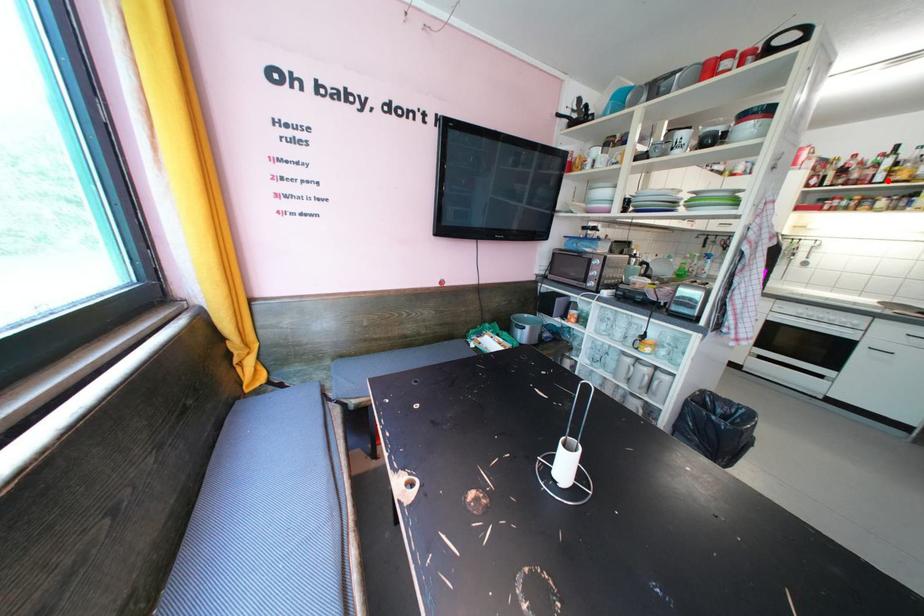
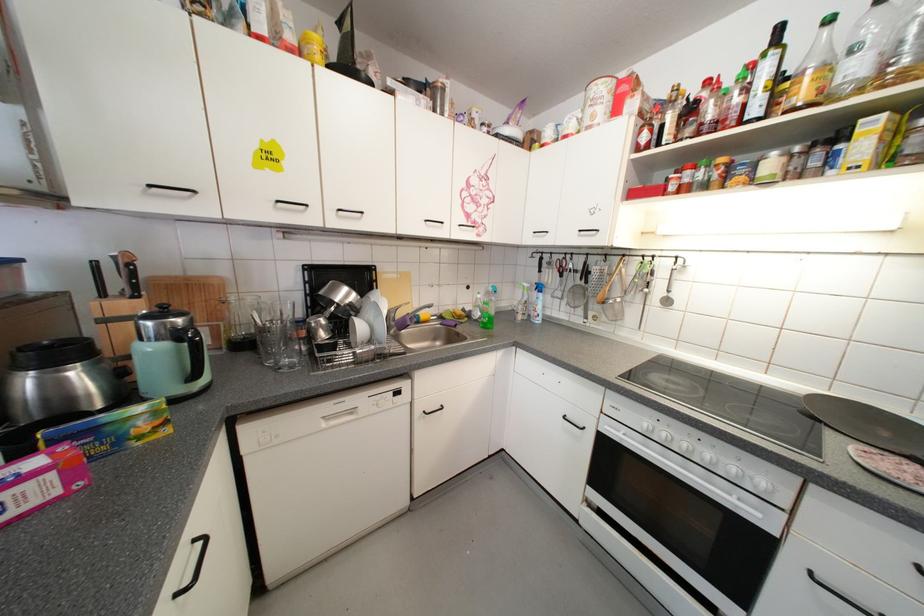
Locate, in the second image, the point that corresponds to the highlighted location in the first image.

(763, 111)